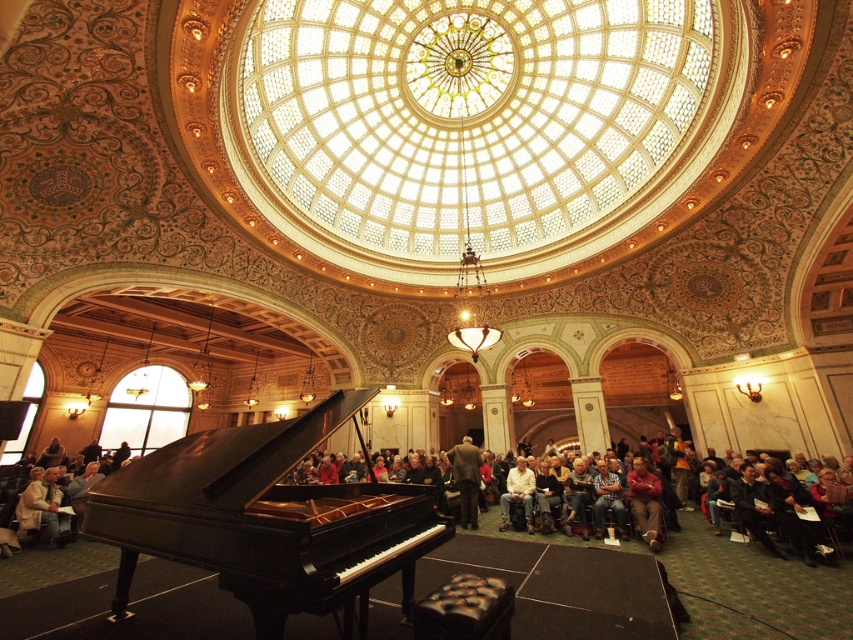
Question: Which object is closer to the camera taking this photo?

Choices:
 (A) high-gloss black piano at center
 (B) dark brown leather jacket at center
 (C) red velvet coat at lower center

Answer: (A)

Question: Does high-gloss black piano at center appear over red velvet coat at lower center?

Choices:
 (A) no
 (B) yes

Answer: (B)

Question: Which object is the closest to the high-gloss black piano at center?

Choices:
 (A) dark brown leather jacket at center
 (B) red velvet coat at lower center

Answer: (A)

Question: Which point appears farthest from the camera in this image?

Choices:
 (A) (469, 460)
 (B) (634, 468)
 (C) (256, 451)

Answer: (A)

Question: Can you confirm if high-gloss black piano at center is positioned to the right of dark brown leather jacket at center?

Choices:
 (A) no
 (B) yes

Answer: (A)

Question: Where is high-gloss black piano at center located in relation to red velvet coat at lower center in the image?

Choices:
 (A) below
 (B) above

Answer: (B)